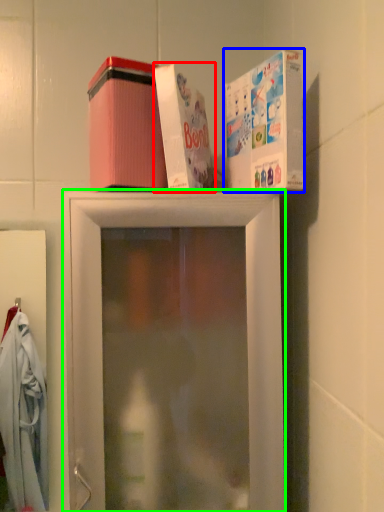
Question: Which object is positioned closest to box (highlighted by a red box)? Select from box (highlighted by a blue box) and shelf (highlighted by a green box).

Choices:
 (A) box
 (B) shelf

Answer: (A)